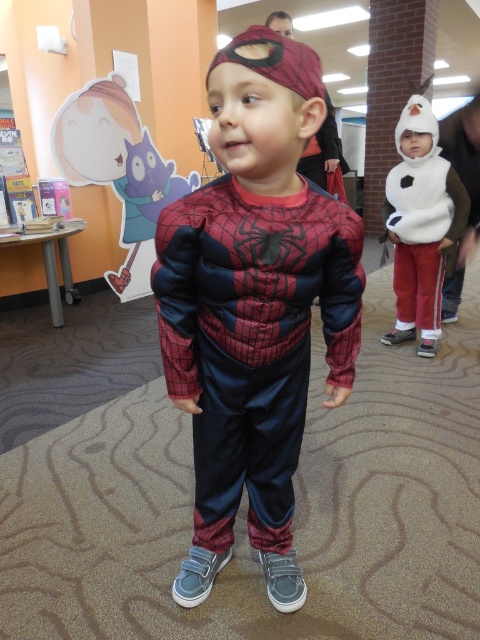
You are a photographer at a costume party and need to position the shiny satin spiderman costume at center so that it is centered exactly at point (254, 307). Can you confirm if the current position matches the required coordinates?

The shiny satin spiderman costume at center is located at point (254, 307), so the current position matches the required coordinates.